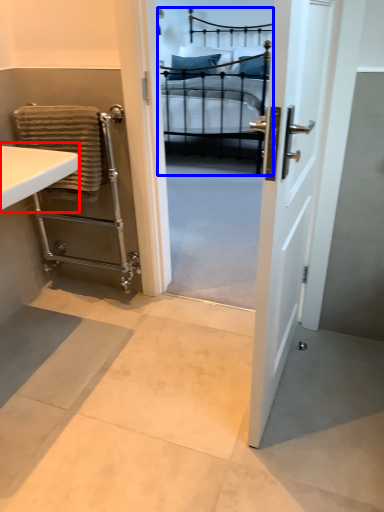
Question: Which object is further to the camera taking this photo, sink (highlighted by a red box) or bed (highlighted by a blue box)?

Choices:
 (A) sink
 (B) bed

Answer: (B)